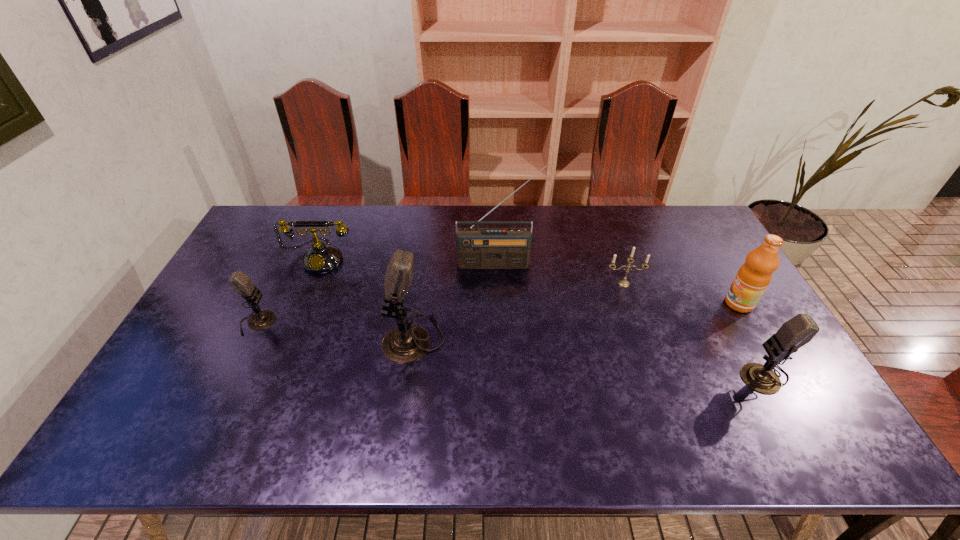
Identify the location of vacant region located 0.380m on the front-facing side of the tallest microphone. This screenshot has height=540, width=960. (247, 339).

Identify the location of vacant space situated on the front-facing side of the tallest microphone. (265, 339).

Identify the location of free region located 0.050m on the front-facing side of the tallest microphone. (365, 339).

Where is `free space located 0.070m on the front-facing side of the second shortest microphone`? This screenshot has width=960, height=540. free space located 0.070m on the front-facing side of the second shortest microphone is located at coordinates (712, 374).

This screenshot has width=960, height=540. Find the location of `free space located on the front-facing side of the second shortest microphone`. free space located on the front-facing side of the second shortest microphone is located at coordinates (636, 374).

Identify the location of vacant area situated on the front-facing side of the second shortest microphone. This screenshot has height=540, width=960. (628, 374).

This screenshot has width=960, height=540. In order to click on vacant region located 0.380m on the dial of the telephone in this screenshot , I will do `click(275, 374)`.

This screenshot has height=540, width=960. I want to click on free region located 0.380m on the left of the fifth object from left to right, so click(484, 284).

Identify the location of free space located on the front-facing side of the radio receiver. This screenshot has width=960, height=540. (499, 298).

You are a GUI agent. You are given a task and a screenshot of the screen. Output one action in this format:
    pyautogui.click(x=<x>, y=<y>)
    Task: Click on the vacant region located 0.070m on the label side of the fruit juice
    Image resolution: width=960 pixels, height=540 pixels.
    Given the screenshot: What is the action you would take?
    pyautogui.click(x=702, y=303)